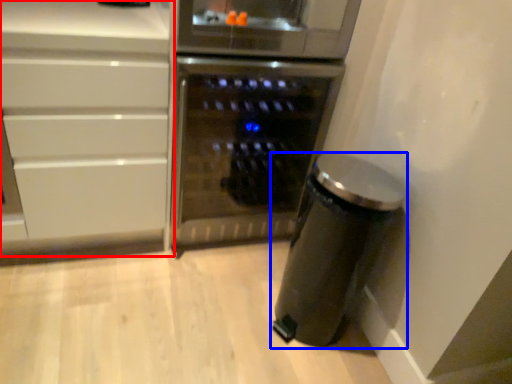
Question: Among these objects, which one is farthest to the camera, cabinetry (highlighted by a red box) or kitchen appliance (highlighted by a blue box)?

Choices:
 (A) cabinetry
 (B) kitchen appliance

Answer: (B)